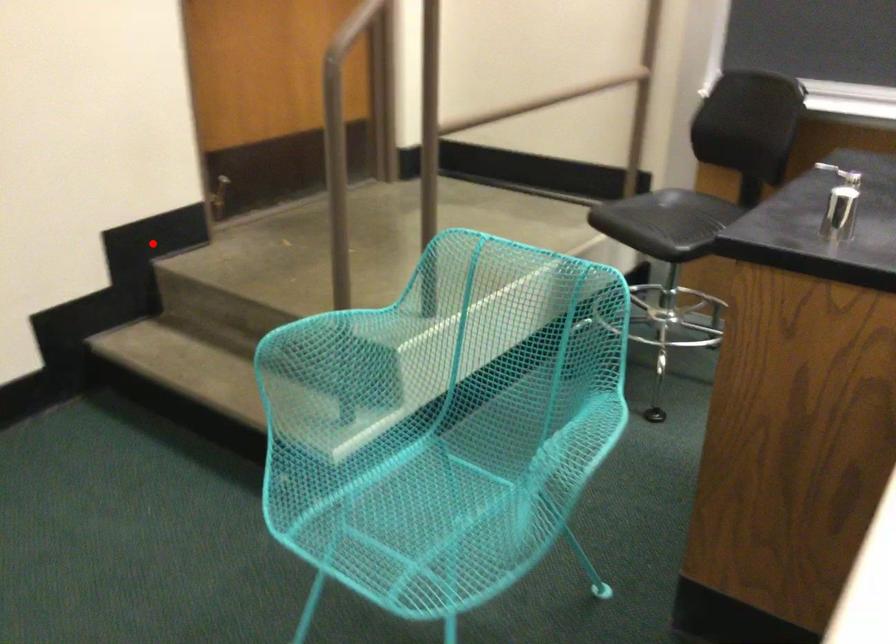
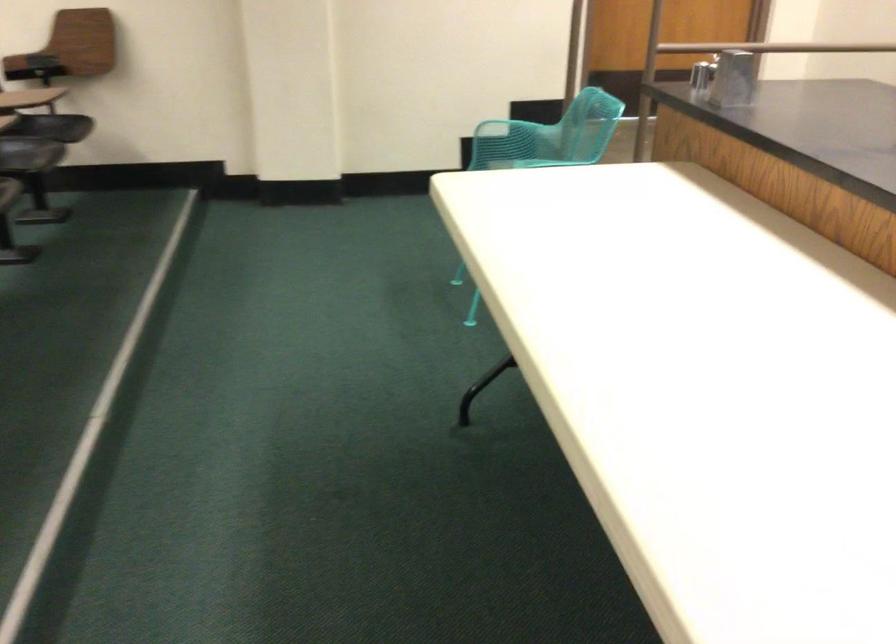
Locate, in the second image, the point that corresponds to the highlighted location in the first image.

(533, 111)